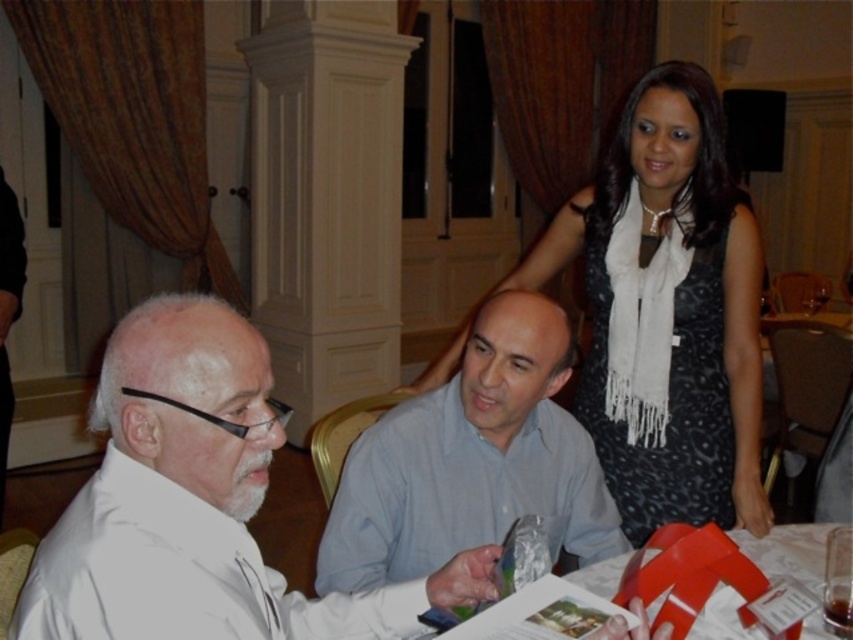
Is point (418, 385) in front of point (567, 428)?

No, (418, 385) is behind (567, 428).

Who is positioned more to the left, black dress at upper right or light blue shirt at center?

From the viewer's perspective, light blue shirt at center appears more on the left side.

You are a GUI agent. You are given a task and a screenshot of the screen. Output one action in this format:
    pyautogui.click(x=<x>, y=<y>)
    Task: Click on the black dress at upper right
    
    Given the screenshot: What is the action you would take?
    pyautogui.click(x=672, y=307)

You are a GUI agent. You are given a task and a screenshot of the screen. Output one action in this format:
    pyautogui.click(x=<x>, y=<y>)
    Task: Click on the black dress at upper right
    The height and width of the screenshot is (640, 853).
    Given the screenshot: What is the action you would take?
    pyautogui.click(x=672, y=307)

Is black dress at upper right shorter than matte red paper at lower right?

Incorrect, black dress at upper right's height does not fall short of matte red paper at lower right's.

Who is more distant from viewer, (538, 257) or (791, 563)?

Point (538, 257)

Does point (680, 474) lie in front of point (788, 538)?

No, it is not.

Image resolution: width=853 pixels, height=640 pixels. Find the location of `black dress at upper right`. black dress at upper right is located at coordinates (672, 307).

Measure the distance between white matte shirt at left and camera.

A distance of 74.36 centimeters exists between white matte shirt at left and camera.

Who is lower down, white matte shirt at left or matte red paper at lower right?

matte red paper at lower right is lower down.

At what (x,y) coordinates should I click in order to perform the action: click on white matte shirt at left. Please return your answer as a coordinate pair (x, y). This screenshot has width=853, height=640. Looking at the image, I should click on (196, 506).